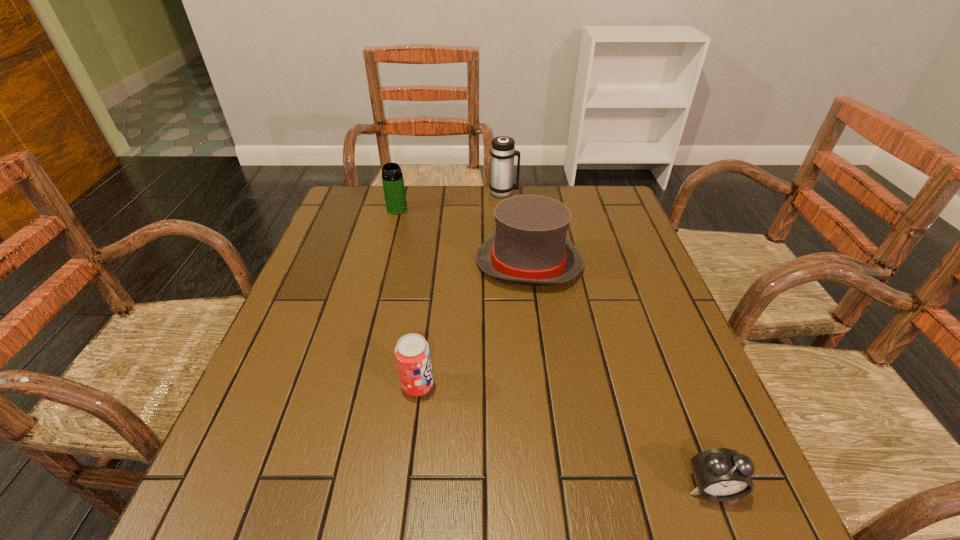
Where is `vacant space located from the spout of the nearer thermos bottle`? vacant space located from the spout of the nearer thermos bottle is located at coordinates [387, 249].

Locate an element on the screen. vacant space located on the left of the third nearest object is located at coordinates (445, 264).

Where is `free space located on the left of the fourth object from right to left`? free space located on the left of the fourth object from right to left is located at coordinates (350, 386).

I want to click on object that is at the near edge, so click(721, 474).

At what (x,y) coordinates should I click in order to perform the action: click on object present at the left edge. Please return your answer as a coordinate pair (x, y). Looking at the image, I should click on (393, 184).

In order to click on object that is at the right edge in this screenshot , I will do `click(721, 474)`.

What are the coordinates of `object that is at the far left corner` in the screenshot? It's located at (393, 184).

You are a GUI agent. You are given a task and a screenshot of the screen. Output one action in this format:
    pyautogui.click(x=<x>, y=<y>)
    Task: Click on the object that is at the near right corner
    The image size is (960, 540).
    Given the screenshot: What is the action you would take?
    point(721,474)

Locate an element on the screen. free region at the far edge is located at coordinates (557, 197).

What are the coordinates of `vacant space at the near edge of the desktop` in the screenshot? It's located at (421, 488).